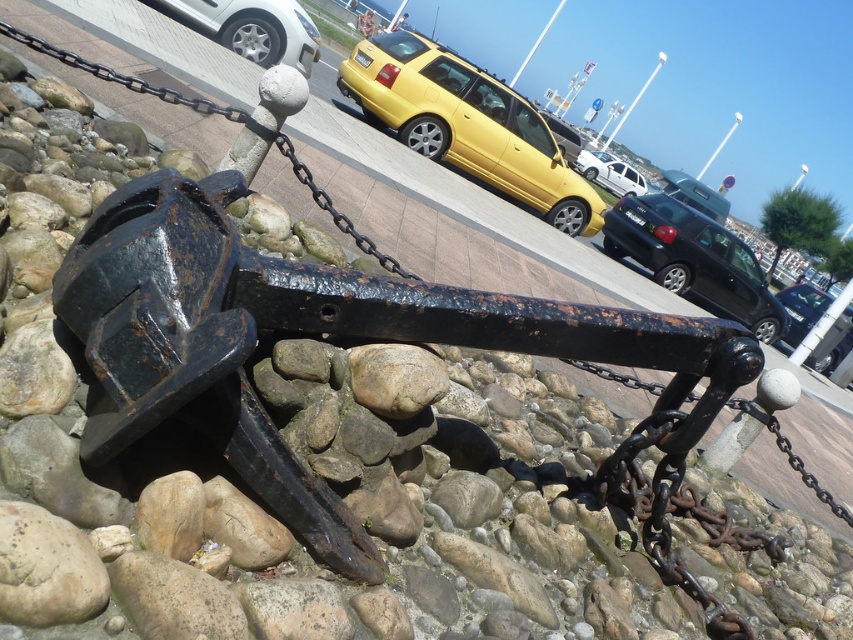
You are standing at the edge of a parking lot and see a metallic silver sedan at center and a white matte van at center. Which vehicle is positioned to the right of the other?

The metallic silver sedan at center is to the right of the white matte van at center.

In the scene shown: You are driving a car and see the metallic silver sedan at center and the white matte van at center in the scene. Which vehicle is blocking your view of the other?

The metallic silver sedan at center is in front of the white matte van at center, so the sedan is blocking the view of the van.

From the picture: You are a photographer trying to capture both the silver metallic car at upper left and the metallic silver car at center in the same frame. Since both cars are silver, how can you distinguish which car is closer to you?

The silver metallic car at upper left is in front of the metallic silver car at center, so it appears closer to you in the frame.